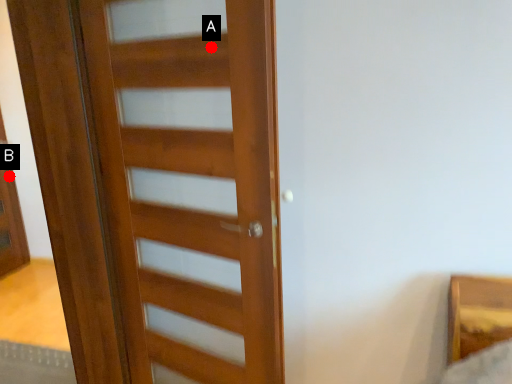
Question: Two points are circled on the image, labeled by A and B beside each circle. Among these points, which one is nearest to the camera?

Choices:
 (A) A is closer
 (B) B is closer

Answer: (A)